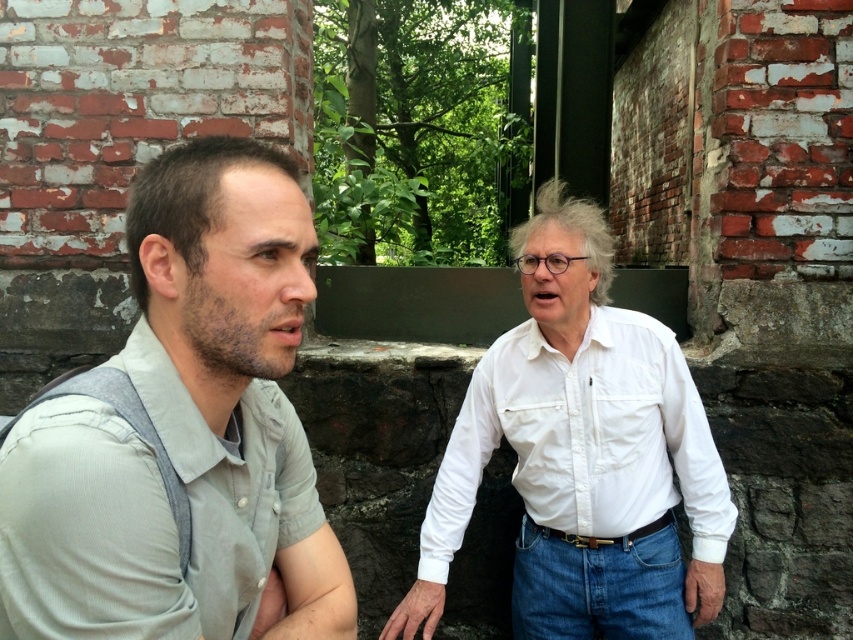
Between gray cotton shirt at left and white cotton shirt at center, which one has less height?

white cotton shirt at center

Can you confirm if gray cotton shirt at left is positioned to the right of white cotton shirt at center?

No, gray cotton shirt at left is not to the right of white cotton shirt at center.

Measure the distance between gray cotton shirt at left and camera.

gray cotton shirt at left is 33.40 inches away from camera.

The height and width of the screenshot is (640, 853). I want to click on gray cotton shirt at left, so click(183, 432).